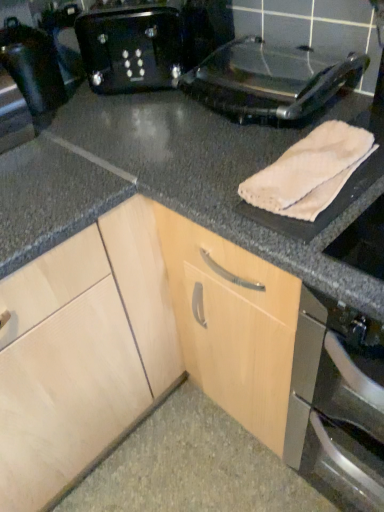
This screenshot has width=384, height=512. I want to click on free location to the left of metallic black toaster at upper right, so 148,133.